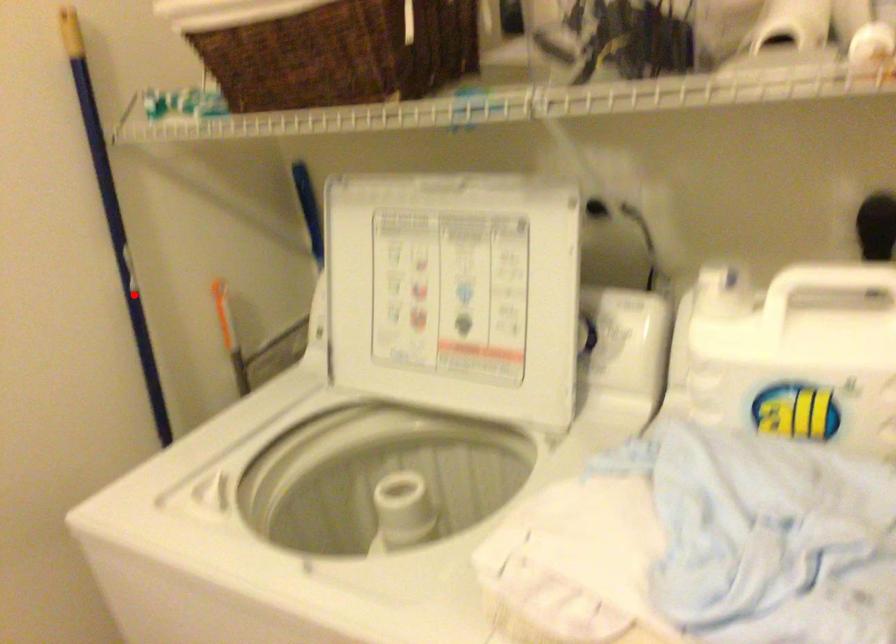
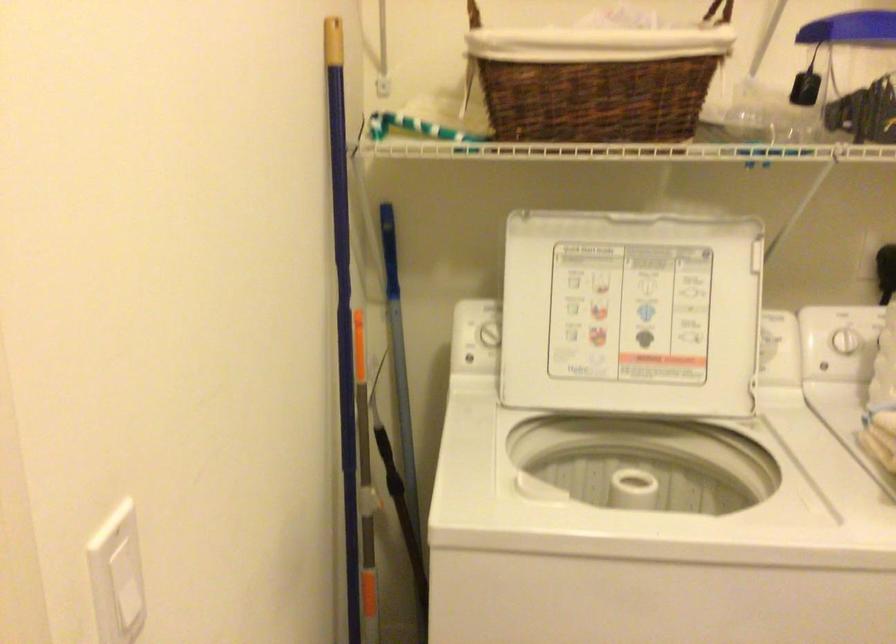
In the second image, find the point that corresponds to the highlighted location in the first image.

(343, 316)